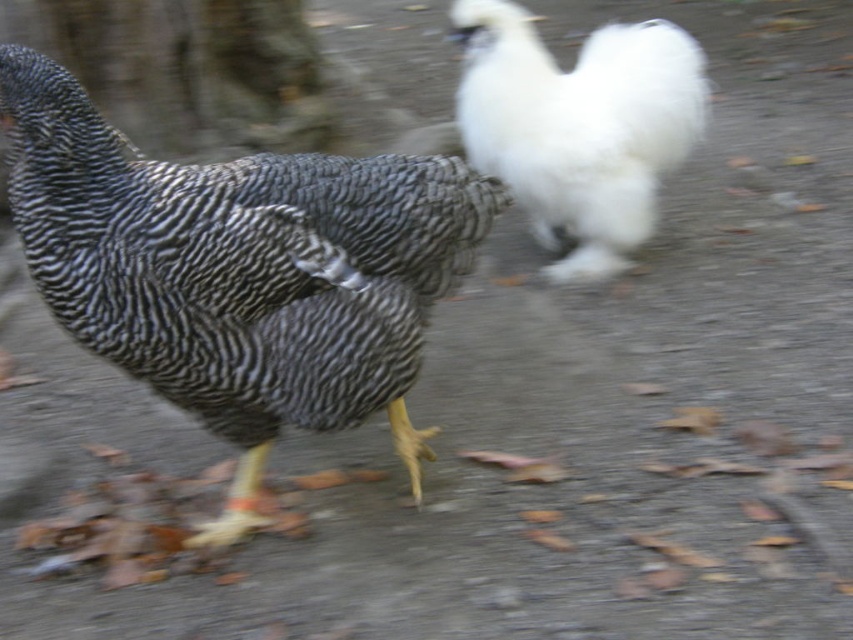
Does speckled feathered chicken at left lie behind white fluffy chicken at upper right?

No.

Between speckled feathered chicken at left and white fluffy chicken at upper right, which one is positioned lower?

speckled feathered chicken at left is lower down.

The image size is (853, 640). Identify the location of speckled feathered chicken at left. (239, 269).

Find the location of a particular element. speckled feathered chicken at left is located at coordinates (239, 269).